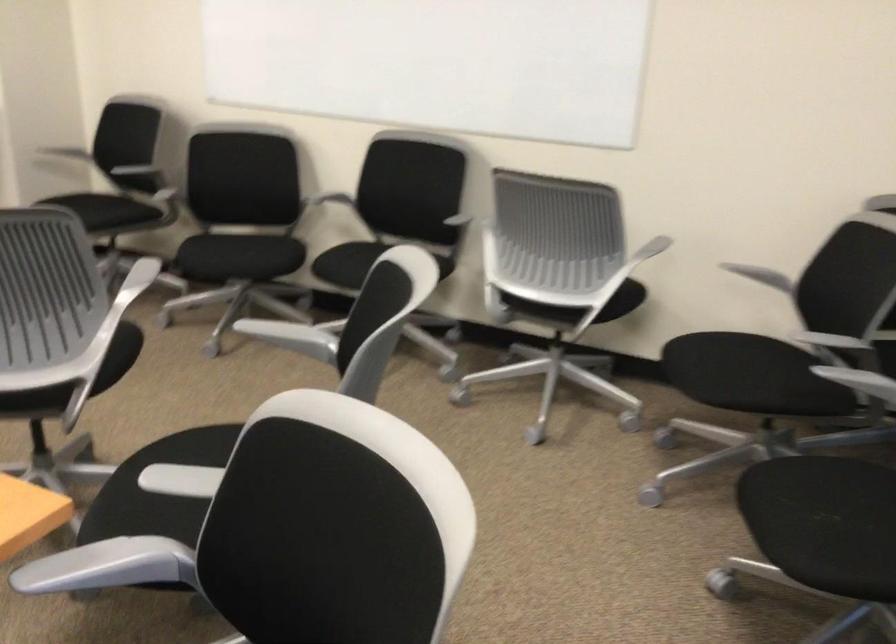
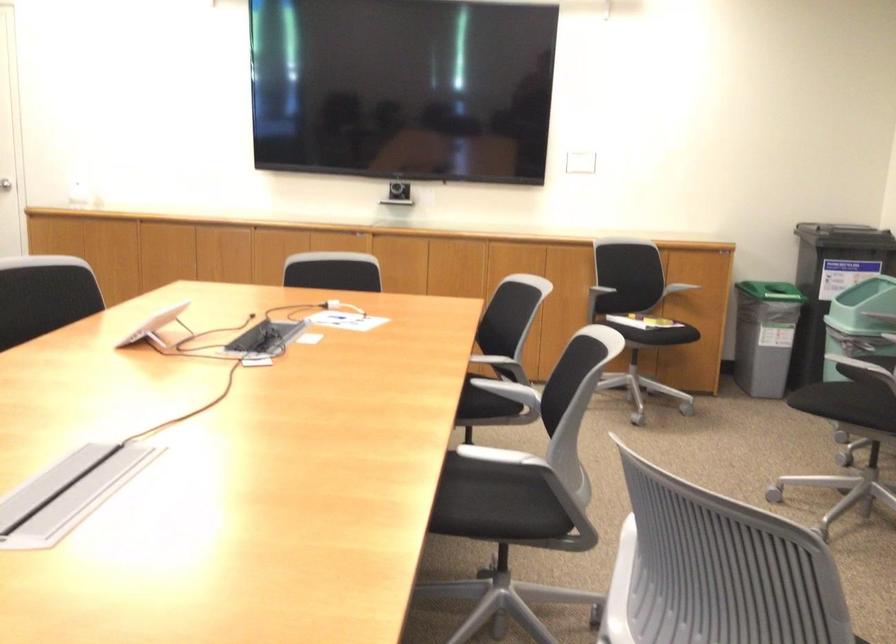
Question: The first image is from the beginning of the video and the second image is from the end. How did the camera likely rotate when shooting the video?

Choices:
 (A) Left
 (B) Right
 (C) Up
 (D) Down

Answer: (A)